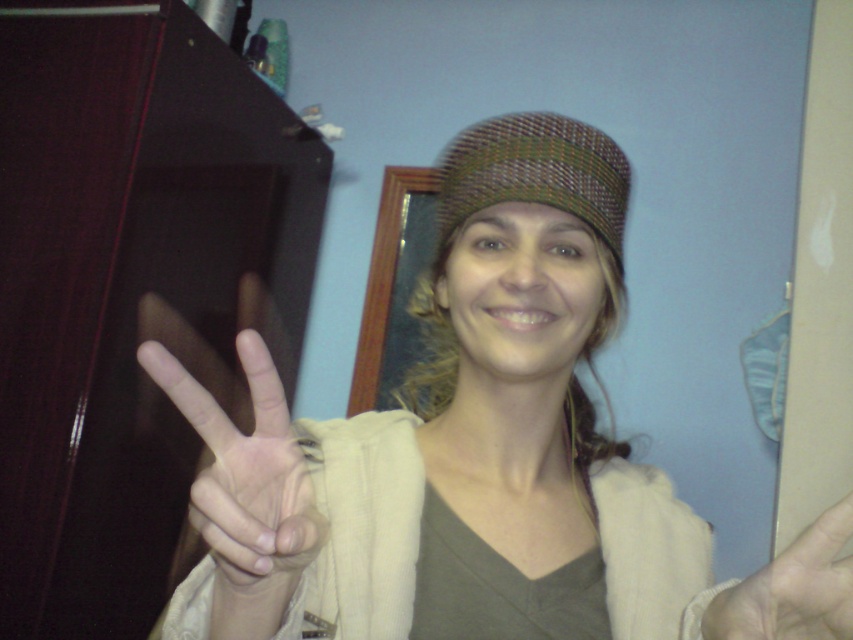
Who is more forward, (543, 452) or (712, 624)?

Point (712, 624)

Which is behind, point (428, 529) or point (764, 577)?

The point (428, 529) is more distant.

In order to click on woolen knit cap at center in this screenshot , I will do `click(457, 442)`.

Is white matte hand at center smaller than woven fabric hat at center?

Yes.

Is white matte hand at center bigger than woven fabric hat at center?

No, white matte hand at center is not bigger than woven fabric hat at center.

I want to click on white matte hand at center, so click(x=245, y=468).

Consider the image. Is woolen knit cap at center wider than white matte hand at center?

Yes, woolen knit cap at center is wider than white matte hand at center.

Between woolen knit cap at center and white matte hand at center, which one appears on the left side from the viewer's perspective?

From the viewer's perspective, white matte hand at center appears more on the left side.

Which is in front, point (585, 577) or point (279, 484)?

Point (279, 484)

Locate an element on the screen. The width and height of the screenshot is (853, 640). woolen knit cap at center is located at coordinates (457, 442).